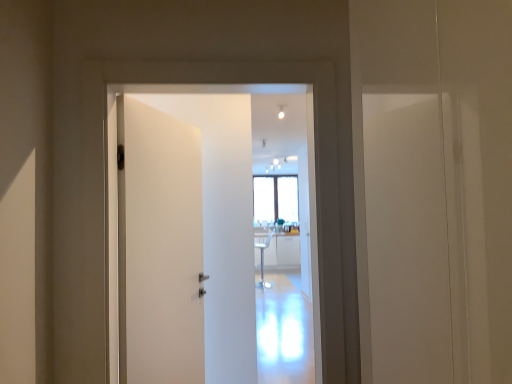
Question: Should I look upward or downward to see white matte door at center?

Choices:
 (A) down
 (B) up

Answer: (A)

Question: Considering the relative sizes of white matte door at center and white glossy light bulb at upper center in the image provided, is white matte door at center wider than white glossy light bulb at upper center?

Choices:
 (A) yes
 (B) no

Answer: (A)

Question: Considering the relative sizes of white matte door at center and white glossy light bulb at upper center in the image provided, is white matte door at center taller than white glossy light bulb at upper center?

Choices:
 (A) yes
 (B) no

Answer: (A)

Question: Would you consider white matte door at center to be distant from white glossy light bulb at upper center?

Choices:
 (A) no
 (B) yes

Answer: (B)

Question: From the image's perspective, is white matte door at center below white glossy light bulb at upper center?

Choices:
 (A) yes
 (B) no

Answer: (A)

Question: Can you confirm if white matte door at center is positioned to the right of white glossy light bulb at upper center?

Choices:
 (A) no
 (B) yes

Answer: (A)

Question: Considering the relative sizes of white matte door at center and white glossy light bulb at upper center in the image provided, is white matte door at center thinner than white glossy light bulb at upper center?

Choices:
 (A) no
 (B) yes

Answer: (A)

Question: From a real-world perspective, is white glossy light bulb at upper center over white matte door at center?

Choices:
 (A) no
 (B) yes

Answer: (B)

Question: Could you tell me if white glossy light bulb at upper center is facing white matte door at center?

Choices:
 (A) yes
 (B) no

Answer: (A)

Question: Does white glossy light bulb at upper center have a lesser width compared to white matte door at center?

Choices:
 (A) yes
 (B) no

Answer: (A)

Question: Does white glossy light bulb at upper center come behind white matte door at center?

Choices:
 (A) no
 (B) yes

Answer: (B)

Question: Does white glossy light bulb at upper center have a greater height compared to white matte door at center?

Choices:
 (A) yes
 (B) no

Answer: (B)

Question: From the image's perspective, does white glossy light bulb at upper center appear higher than white matte door at center?

Choices:
 (A) yes
 (B) no

Answer: (A)

Question: Considering their positions, is white matte door at center located in front of or behind white glossy light bulb at upper center?

Choices:
 (A) behind
 (B) front

Answer: (B)